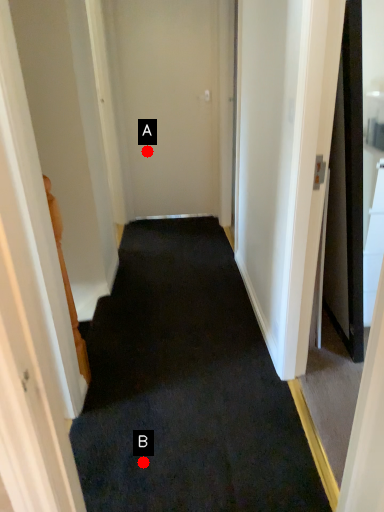
Question: Two points are circled on the image, labeled by A and B beside each circle. Which point is closer to the camera?

Choices:
 (A) A is closer
 (B) B is closer

Answer: (B)